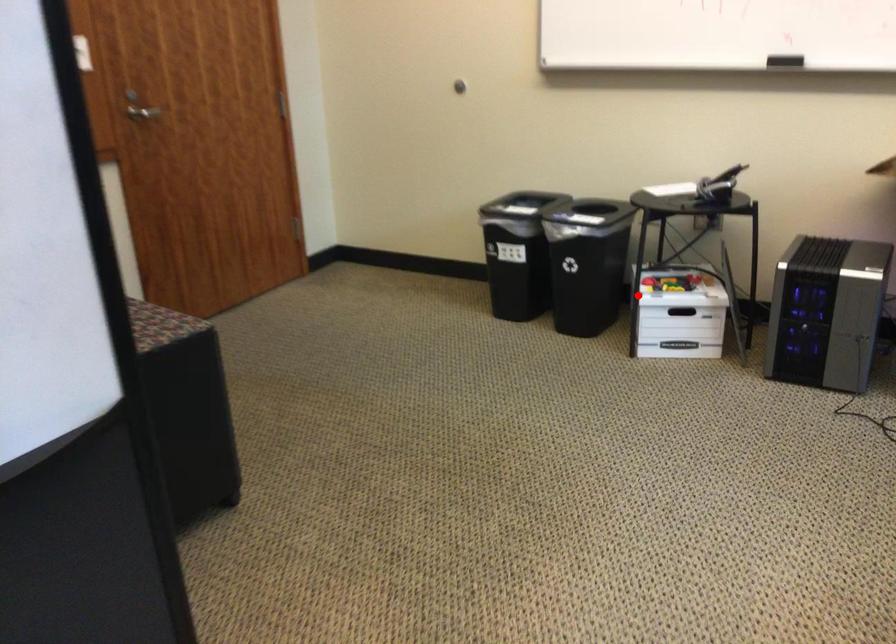
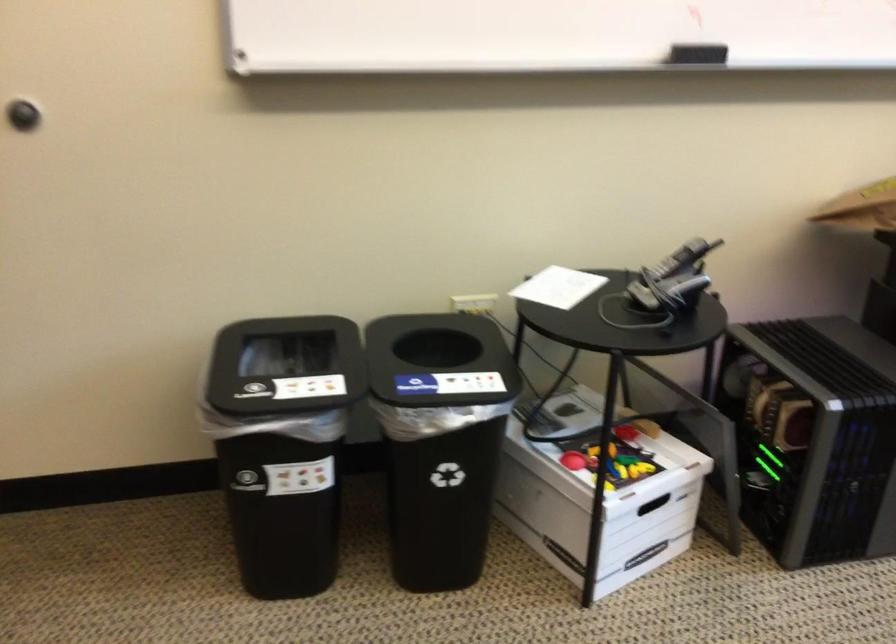
Question: I am providing you with two images of the same scene from different viewpoints. A red point is shown in image1. For the corresponding object point in image2, is it positioned nearer or farther from the camera?

Choices:
 (A) Nearer
 (B) Farther

Answer: (A)